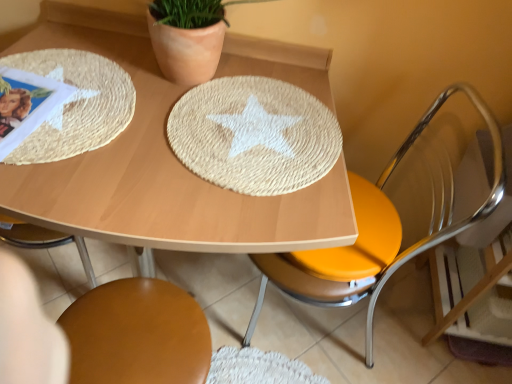
This screenshot has height=384, width=512. Describe the element at coordinates (75, 104) in the screenshot. I see `raffia textured placemat at upper left` at that location.

This screenshot has width=512, height=384. In order to click on raffia textured placemat at upper left in this screenshot , I will do `click(75, 104)`.

Where is `brown leather chair at lower center, positioned as the second chair in right-to-left order`? brown leather chair at lower center, positioned as the second chair in right-to-left order is located at coordinates (137, 334).

Could you tell me if raffia textured placemat at upper left is facing metallic yellow seat at right, acting as the second chair starting from the left?

No, raffia textured placemat at upper left is not facing towards metallic yellow seat at right, acting as the second chair starting from the left.

Can you tell me how much raffia textured placemat at upper left and metallic yellow seat at right, which ranks as the first chair in right-to-left order, differ in facing direction?

87.5 degrees separate the facing orientations of raffia textured placemat at upper left and metallic yellow seat at right, which ranks as the first chair in right-to-left order.

Can you confirm if raffia textured placemat at upper left is wider than metallic yellow seat at right, acting as the second chair starting from the left?

Incorrect, the width of raffia textured placemat at upper left does not surpass that of metallic yellow seat at right, acting as the second chair starting from the left.

From the image's perspective, between woven straw placemat at center and brown leather chair at lower center, positioned as the second chair in right-to-left order, which one is located above?

woven straw placemat at center.

Can you confirm if woven straw placemat at center is bigger than brown leather chair at lower center, positioned as the second chair in right-to-left order?

Incorrect, woven straw placemat at center is not larger than brown leather chair at lower center, positioned as the second chair in right-to-left order.

From a real-world perspective, who is located higher, woven straw placemat at center or brown leather chair at lower center, positioned as the second chair in right-to-left order?

woven straw placemat at center.

Consider the image. Is woven straw placemat at center oriented towards brown leather chair at lower center, positioned as the second chair in right-to-left order?

No, woven straw placemat at center is not facing towards brown leather chair at lower center, positioned as the second chair in right-to-left order.

Considering the positions of points (338, 178) and (170, 117), is point (338, 178) closer to camera compared to point (170, 117)?

Yes, point (338, 178) is in front of point (170, 117).

How different are the orientations of natural fiber placemat at center and woven straw placemat at center in degrees?

natural fiber placemat at center and woven straw placemat at center are facing 0.0946 degrees away from each other.

Does natural fiber placemat at center have a larger size compared to woven straw placemat at center?

Yes, natural fiber placemat at center is bigger than woven straw placemat at center.

From the image's perspective, would you say natural fiber placemat at center is positioned over woven straw placemat at center?

Incorrect, from the image's perspective, natural fiber placemat at center is lower than woven straw placemat at center.

Considering the sizes of objects natural fiber placemat at center and raffia textured placemat at upper left in the image provided, who is bigger, natural fiber placemat at center or raffia textured placemat at upper left?

Bigger between the two is natural fiber placemat at center.

Would you say natural fiber placemat at center is outside raffia textured placemat at upper left?

natural fiber placemat at center is positioned outside raffia textured placemat at upper left.

In the scene shown: Is natural fiber placemat at center wider or thinner than raffia textured placemat at upper left?

natural fiber placemat at center is wider than raffia textured placemat at upper left.

Which object is positioned more to the right, natural fiber placemat at center or raffia textured placemat at upper left?

From the viewer's perspective, natural fiber placemat at center appears more on the right side.

Is woven straw placemat at center positioned far away from raffia textured placemat at upper left?

That's not correct — woven straw placemat at center is a little close to raffia textured placemat at upper left.

Does woven straw placemat at center have a lesser width compared to raffia textured placemat at upper left?

Incorrect, the width of woven straw placemat at center is not less than that of raffia textured placemat at upper left.

How many degrees apart are the facing directions of woven straw placemat at center and raffia textured placemat at upper left?

woven straw placemat at center and raffia textured placemat at upper left are facing 2.57 degrees away from each other.

Locate an element on the screen. The image size is (512, 384). plate on the right of raffia textured placemat at upper left is located at coordinates (254, 135).

Is natural fiber placemat at center taller or shorter than metallic yellow seat at right, acting as the second chair starting from the left?

Clearly, natural fiber placemat at center is shorter compared to metallic yellow seat at right, acting as the second chair starting from the left.

At what (x,y) coordinates should I click in order to perform the action: click on chair positioned vertically above the natural fiber placemat at center (from a real-world perspective). Please return your answer as a coordinate pair (x, y). This screenshot has width=512, height=384. Looking at the image, I should click on (374, 236).

In the image, is natural fiber placemat at center on the left side or the right side of metallic yellow seat at right, acting as the second chair starting from the left?

natural fiber placemat at center is positioned on metallic yellow seat at right, acting as the second chair starting from the left,'s left side.

Is natural fiber placemat at center positioned far away from metallic yellow seat at right, which ranks as the first chair in right-to-left order?

No, there isn't a large distance between natural fiber placemat at center and metallic yellow seat at right, which ranks as the first chair in right-to-left order.

Who is shorter, metallic yellow seat at right, which ranks as the first chair in right-to-left order, or raffia textured placemat at upper left?

Standing shorter between the two is raffia textured placemat at upper left.

Between metallic yellow seat at right, which ranks as the first chair in right-to-left order, and raffia textured placemat at upper left, which one appears on the right side from the viewer's perspective?

From the viewer's perspective, metallic yellow seat at right, which ranks as the first chair in right-to-left order, appears more on the right side.

Which of these two, metallic yellow seat at right, which ranks as the first chair in right-to-left order, or raffia textured placemat at upper left, is wider?

With larger width is metallic yellow seat at right, which ranks as the first chair in right-to-left order.

Where is `the 1st chair positioned below the raffia textured placemat at upper left (from a real-world perspective)`? The height and width of the screenshot is (384, 512). the 1st chair positioned below the raffia textured placemat at upper left (from a real-world perspective) is located at coordinates (374, 236).

At what (x,y) coordinates should I click in order to perform the action: click on chair that appears behind the woven straw placemat at center. Please return your answer as a coordinate pair (x, y). The image size is (512, 384). Looking at the image, I should click on (137, 334).

Which object lies nearer to the anchor point raffia textured placemat at upper left, woven straw placemat at center or natural fiber placemat at center?

Among the two, natural fiber placemat at center is located nearer to raffia textured placemat at upper left.

Based on their spatial positions, is natural fiber placemat at center or woven straw placemat at center closer to brown leather chair at lower center, acting as the first chair starting from the left?

Based on the image, natural fiber placemat at center appears to be nearer to brown leather chair at lower center, acting as the first chair starting from the left.

Looking at this image, based on their spatial positions, is natural fiber placemat at center or metallic yellow seat at right, acting as the second chair starting from the left, further from brown leather chair at lower center, positioned as the second chair in right-to-left order?

metallic yellow seat at right, acting as the second chair starting from the left, is positioned further to the anchor brown leather chair at lower center, positioned as the second chair in right-to-left order.

When comparing their distances from metallic yellow seat at right, acting as the second chair starting from the left, does brown leather chair at lower center, positioned as the second chair in right-to-left order, or raffia textured placemat at upper left seem closer?

brown leather chair at lower center, positioned as the second chair in right-to-left order, lies closer to metallic yellow seat at right, acting as the second chair starting from the left, than the other object.

Considering their positions, is woven straw placemat at center positioned closer to brown leather chair at lower center, positioned as the second chair in right-to-left order, than natural fiber placemat at center?

natural fiber placemat at center is closer to brown leather chair at lower center, positioned as the second chair in right-to-left order.

Which object lies further to the anchor point metallic yellow seat at right, which ranks as the first chair in right-to-left order, raffia textured placemat at upper left or brown leather chair at lower center, acting as the first chair starting from the left?

raffia textured placemat at upper left is positioned further to the anchor metallic yellow seat at right, which ranks as the first chair in right-to-left order.

Considering their positions, is raffia textured placemat at upper left positioned further to brown leather chair at lower center, positioned as the second chair in right-to-left order, than metallic yellow seat at right, acting as the second chair starting from the left?

metallic yellow seat at right, acting as the second chair starting from the left, is positioned further to the anchor brown leather chair at lower center, positioned as the second chair in right-to-left order.

From the image, which object appears to be farther from natural fiber placemat at center, raffia textured placemat at upper left or woven straw placemat at center?

raffia textured placemat at upper left lies further to natural fiber placemat at center than the other object.

Locate an element on the screen. The width and height of the screenshot is (512, 384). chair situated between raffia textured placemat at upper left and metallic yellow seat at right, acting as the second chair starting from the left, from left to right is located at coordinates (137, 334).

Locate an element on the screen. This screenshot has width=512, height=384. table located between raffia textured placemat at upper left and woven straw placemat at center in the left-right direction is located at coordinates (160, 178).

At what (x,y) coordinates should I click in order to perform the action: click on chair that lies between woven straw placemat at center and brown leather chair at lower center, acting as the first chair starting from the left, from top to bottom. Please return your answer as a coordinate pair (x, y). Looking at the image, I should click on (374, 236).

The image size is (512, 384). In order to click on table between woven straw placemat at center and brown leather chair at lower center, positioned as the second chair in right-to-left order, in the vertical direction in this screenshot , I will do [x=160, y=178].